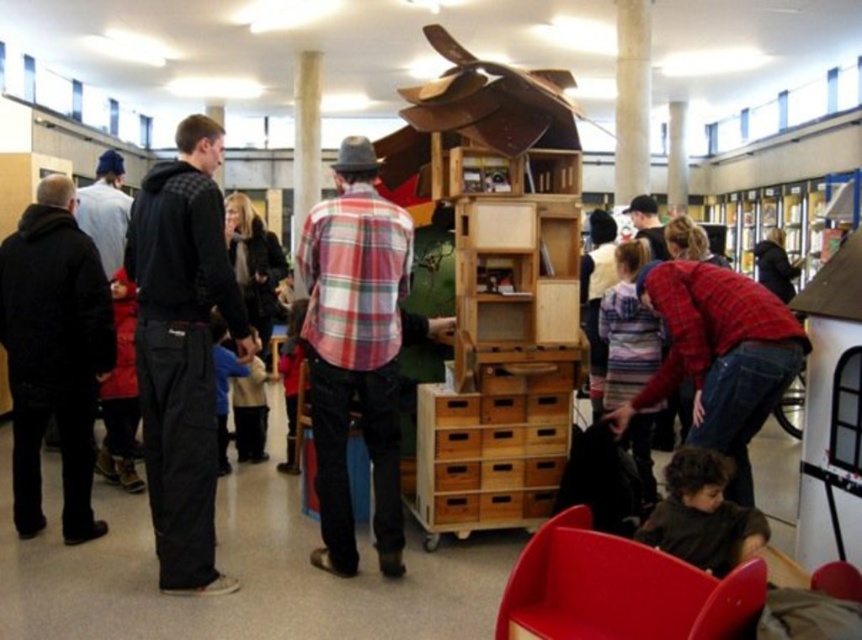
Please use the coordinates provided to identify the object located at point (x=182, y=348) in the scene. Which object is it?

The object at point (x=182, y=348) is the black matte pants at left.

You are a photographer setting up a shoot in this room. You need to place a narrow tripod that is 0.5 meters wide between the black matte jacket at left and the matte red chair at lower right. Will there be enough space for the tripod?

The black matte jacket at left is thinner than the matte red chair at lower right, so the space between them should accommodate the 0.5 meters wide tripod.

You are standing in the community center and see the black matte jacket at left. If you want to move towards the large wooden playhouse structure, should you walk to the right or left of the jacket?

Since the black matte jacket at left is located at point (54, 353), you should walk to the right of it to reach the large wooden playhouse structure.